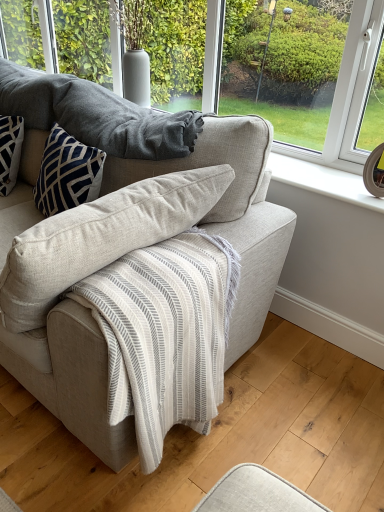
Question: Does light beige fabric couch at center have a smaller size compared to transparent glass window at upper center?

Choices:
 (A) no
 (B) yes

Answer: (A)

Question: From the image's perspective, is light beige fabric couch at center below transparent glass window at upper center?

Choices:
 (A) yes
 (B) no

Answer: (A)

Question: Is light beige fabric couch at center with transparent glass window at upper center?

Choices:
 (A) yes
 (B) no

Answer: (B)

Question: Could you tell me if light beige fabric couch at center is facing transparent glass window at upper center?

Choices:
 (A) yes
 (B) no

Answer: (B)

Question: Is light beige fabric couch at center further to camera compared to transparent glass window at upper center?

Choices:
 (A) no
 (B) yes

Answer: (A)

Question: Considering their positions, is light beige fabric couch at center located in front of or behind textured wool blanket at upper center?

Choices:
 (A) behind
 (B) front

Answer: (B)

Question: In terms of width, does light beige fabric couch at center look wider or thinner when compared to textured wool blanket at upper center?

Choices:
 (A) wide
 (B) thin

Answer: (A)

Question: Is light beige fabric couch at center situated inside textured wool blanket at upper center or outside?

Choices:
 (A) inside
 (B) outside

Answer: (B)

Question: From the image's perspective, is light beige fabric couch at center positioned above or below textured wool blanket at upper center?

Choices:
 (A) below
 (B) above

Answer: (A)

Question: Is point (354, 114) positioned closer to the camera than point (24, 182)?

Choices:
 (A) closer
 (B) farther

Answer: (A)

Question: Considering the positions of transparent glass window at upper center and light beige fabric couch at center in the image, is transparent glass window at upper center bigger or smaller than light beige fabric couch at center?

Choices:
 (A) big
 (B) small

Answer: (B)

Question: Considering their positions, is transparent glass window at upper center located in front of or behind light beige fabric couch at center?

Choices:
 (A) front
 (B) behind

Answer: (B)

Question: In terms of width, does transparent glass window at upper center look wider or thinner when compared to light beige fabric couch at center?

Choices:
 (A) thin
 (B) wide

Answer: (A)

Question: From the image's perspective, is light beige fabric couch at center positioned above or below transparent glass window at upper center?

Choices:
 (A) below
 (B) above

Answer: (A)

Question: Choose the correct answer: Is light beige fabric couch at center inside transparent glass window at upper center or outside it?

Choices:
 (A) outside
 (B) inside

Answer: (A)